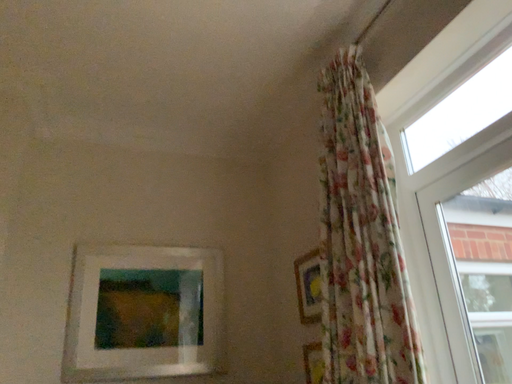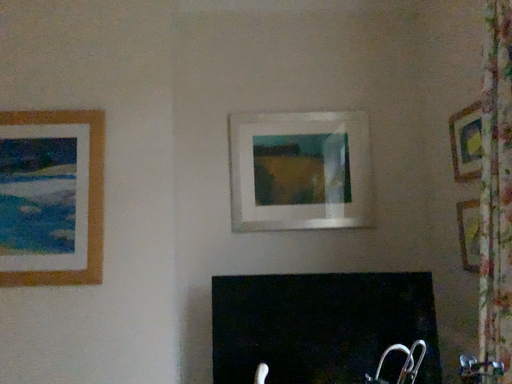
Question: Which way did the camera rotate in the video?

Choices:
 (A) rotated upward
 (B) rotated downward

Answer: (B)